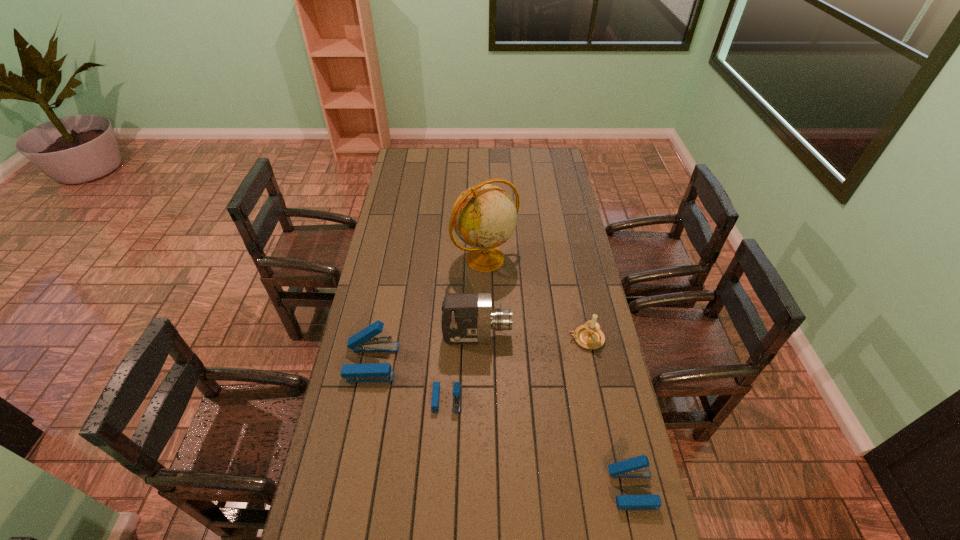
Identify the location of vacant spot for a new stapler_(stapling_machine) to ensure equal spacing. (533, 441).